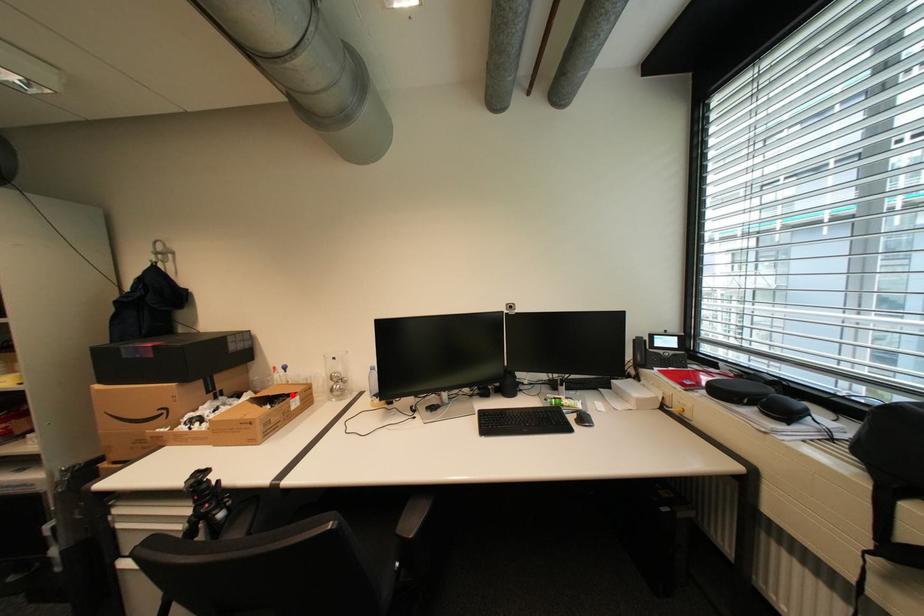
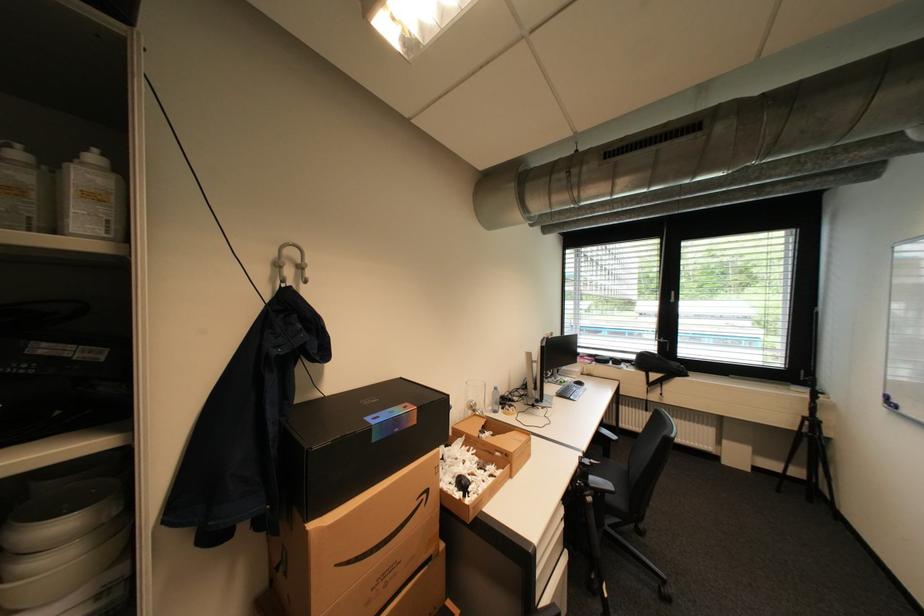
Question: I am providing you with two images of the same scene from different viewpoints. A red point is marked on the first image. Can you still see the location of the red point in image 2?

Choices:
 (A) Yes
 (B) No

Answer: (A)